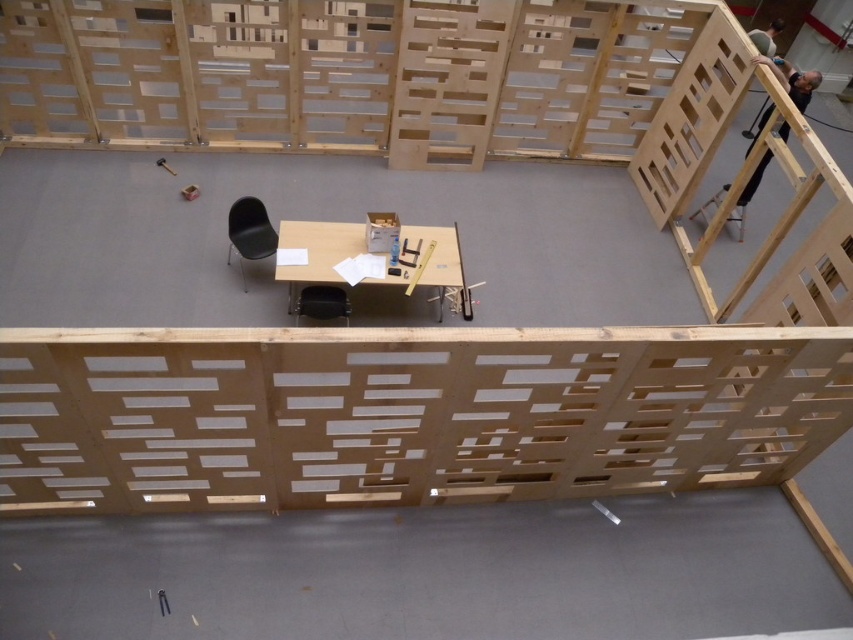
Does black matte chair at center appear on the left side of black plastic chair at center?

Yes, black matte chair at center is to the left of black plastic chair at center.

Is black matte chair at center smaller than black plastic chair at center?

Indeed, black matte chair at center has a smaller size compared to black plastic chair at center.

Which is behind, point (267, 230) or point (347, 308)?

The point (267, 230) is behind.

I want to click on black matte chair at center, so click(x=248, y=232).

Does matte brown table at center appear under black plastic chair at center?

No, matte brown table at center is not below black plastic chair at center.

The height and width of the screenshot is (640, 853). I want to click on matte brown table at center, so click(428, 266).

Does point (384, 250) come behind point (315, 308)?

Yes.

Where is `matte brown table at center`? Image resolution: width=853 pixels, height=640 pixels. matte brown table at center is located at coordinates (428, 266).

Is matte brown table at center taller than black matte chair at center?

Correct, matte brown table at center is much taller as black matte chair at center.

Which is behind, point (305, 280) or point (238, 259)?

Positioned behind is point (238, 259).

You are a GUI agent. You are given a task and a screenshot of the screen. Output one action in this format:
    pyautogui.click(x=<x>, y=<y>)
    Task: Click on the matte brown table at center
    This screenshot has height=640, width=853.
    Given the screenshot: What is the action you would take?
    pyautogui.click(x=428, y=266)